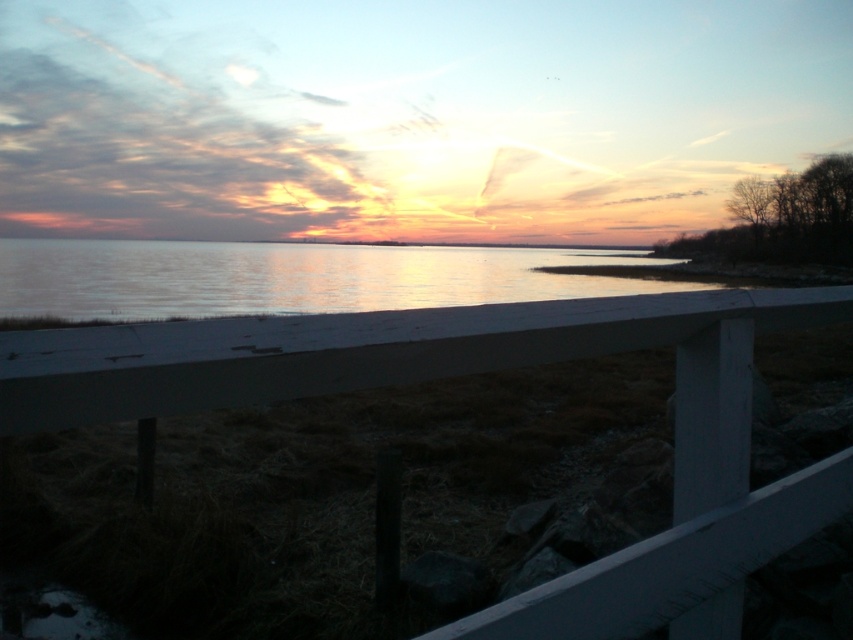
Is white painted wood rail at upper center below smooth water at center?

Indeed, white painted wood rail at upper center is positioned under smooth water at center.

Who is shorter, white painted wood rail at upper center or smooth water at center?

white painted wood rail at upper center

Measure the distance between white painted wood rail at upper center and camera.

white painted wood rail at upper center and camera are 33.82 inches apart.

At what (x,y) coordinates should I click in order to perform the action: click on white painted wood rail at upper center. Please return your answer as a coordinate pair (x, y). Image resolution: width=853 pixels, height=640 pixels. Looking at the image, I should click on (480, 371).